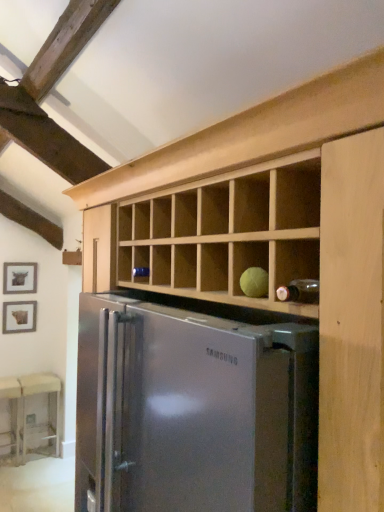
Question: Is matte black picture frame at left, the 2th picture frame in the bottom-to-top sequence, located outside wooden table at lower left, the 1th table in the left-to-right sequence?

Choices:
 (A) no
 (B) yes

Answer: (B)

Question: Is matte black picture frame at left, arranged as the 1th picture frame when viewed from the top, turned away from wooden table at lower left, the 1th table in the left-to-right sequence?

Choices:
 (A) no
 (B) yes

Answer: (A)

Question: From the image's perspective, is matte black picture frame at left, the 2th picture frame in the bottom-to-top sequence, above wooden table at lower left, positioned as the 2th table in right-to-left order?

Choices:
 (A) no
 (B) yes

Answer: (B)

Question: Considering the relative sizes of matte black picture frame at left, the 2th picture frame in the bottom-to-top sequence, and wooden table at lower left, the 1th table in the left-to-right sequence, in the image provided, is matte black picture frame at left, the 2th picture frame in the bottom-to-top sequence, smaller than wooden table at lower left, the 1th table in the left-to-right sequence,?

Choices:
 (A) yes
 (B) no

Answer: (A)

Question: Is wooden table at lower left, the 1th table in the left-to-right sequence, surrounded by matte black picture frame at left, arranged as the 1th picture frame when viewed from the top?

Choices:
 (A) yes
 (B) no

Answer: (B)

Question: From the image's perspective, is matte black picture frame at left, the 2th picture frame in the bottom-to-top sequence, under wooden table at lower left, the 1th table in the left-to-right sequence?

Choices:
 (A) no
 (B) yes

Answer: (A)

Question: From the image's perspective, is beige fabric table at lower left, positioned as the 2th table in left-to-right order, beneath wooden table at lower left, the 1th table in the left-to-right sequence?

Choices:
 (A) no
 (B) yes

Answer: (B)

Question: Is beige fabric table at lower left, positioned as the 2th table in left-to-right order, looking in the opposite direction of wooden table at lower left, positioned as the 2th table in right-to-left order?

Choices:
 (A) no
 (B) yes

Answer: (A)

Question: Is the depth of beige fabric table at lower left, positioned as the 2th table in left-to-right order, less than that of wooden table at lower left, positioned as the 2th table in right-to-left order?

Choices:
 (A) no
 (B) yes

Answer: (A)

Question: Is beige fabric table at lower left, positioned as the 2th table in left-to-right order, thinner than wooden table at lower left, positioned as the 2th table in right-to-left order?

Choices:
 (A) no
 (B) yes

Answer: (B)

Question: Can you confirm if beige fabric table at lower left, which appears as the 1th table when viewed from the right, is shorter than wooden table at lower left, the 1th table in the left-to-right sequence?

Choices:
 (A) yes
 (B) no

Answer: (B)

Question: Is wooden table at lower left, positioned as the 2th table in right-to-left order, surrounded by beige fabric table at lower left, positioned as the 2th table in left-to-right order?

Choices:
 (A) yes
 (B) no

Answer: (B)

Question: Does stainless steel refrigerator at center turn towards matte brown picture frame at left, positioned as the 2th picture frame in top-to-bottom order?

Choices:
 (A) no
 (B) yes

Answer: (A)